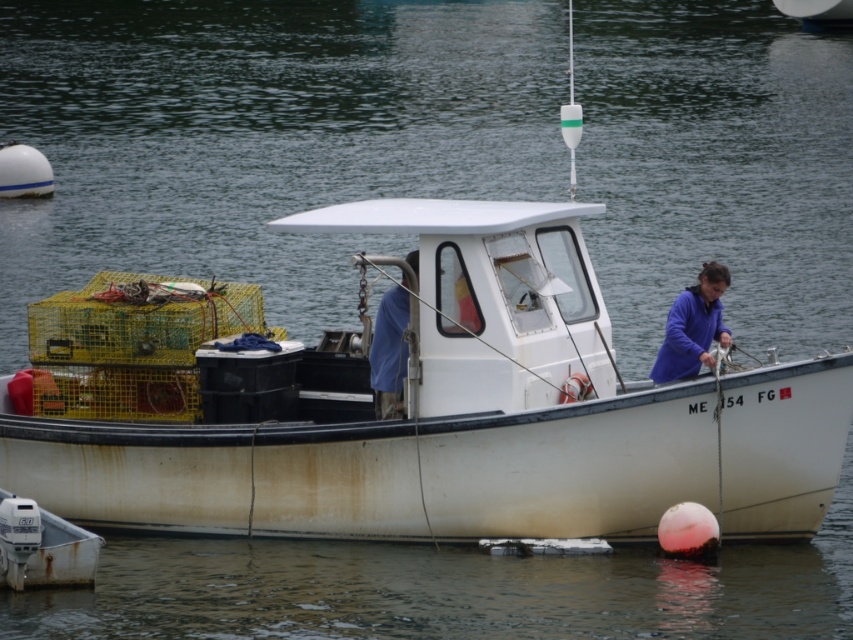
Question: Which point appears farthest from the camera in this image?

Choices:
 (A) (669, 349)
 (B) (368, 355)

Answer: (B)

Question: Does purple matte jacket at center appear on the right side of blue fabric at center?

Choices:
 (A) yes
 (B) no

Answer: (A)

Question: Considering the relative positions of purple matte jacket at center and blue fabric at center in the image provided, where is purple matte jacket at center located with respect to blue fabric at center?

Choices:
 (A) below
 (B) above

Answer: (B)

Question: Is purple matte jacket at center positioned before blue fabric at center?

Choices:
 (A) no
 (B) yes

Answer: (A)

Question: Which object appears farthest from the camera in this image?

Choices:
 (A) blue fabric at center
 (B) purple matte jacket at center

Answer: (B)

Question: Which point is farther to the camera?

Choices:
 (A) (683, 316)
 (B) (415, 348)

Answer: (A)